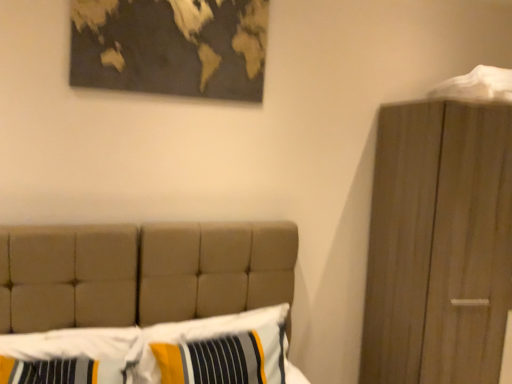
Question: Are striped fabric pillow at lower left, the second pillow viewed from the right, and white fabric at upper right far apart?

Choices:
 (A) yes
 (B) no

Answer: (A)

Question: From a real-world perspective, is striped fabric pillow at lower left, the second pillow viewed from the right, located beneath white fabric at upper right?

Choices:
 (A) yes
 (B) no

Answer: (A)

Question: Does striped fabric pillow at lower left, the second pillow viewed from the right, have a smaller size compared to white fabric at upper right?

Choices:
 (A) no
 (B) yes

Answer: (A)

Question: Is striped fabric pillow at lower left, the second pillow viewed from the right, positioned with its back to white fabric at upper right?

Choices:
 (A) no
 (B) yes

Answer: (A)

Question: Can you confirm if striped fabric pillow at lower left, which appears as the 1th pillow when viewed from the left, is positioned to the left of white fabric at upper right?

Choices:
 (A) no
 (B) yes

Answer: (B)

Question: From the image's perspective, is striped fabric pillow at lower left, which appears as the 1th pillow when viewed from the left, below white fabric at upper right?

Choices:
 (A) no
 (B) yes

Answer: (B)

Question: Does white fabric at upper right have a lesser height compared to striped fabric pillow at lower left, the second pillow viewed from the right?

Choices:
 (A) yes
 (B) no

Answer: (A)

Question: Is white fabric at upper right wider than striped fabric pillow at lower left, which appears as the 1th pillow when viewed from the left?

Choices:
 (A) no
 (B) yes

Answer: (B)

Question: Does white fabric at upper right appear on the right side of striped fabric pillow at lower left, the second pillow viewed from the right?

Choices:
 (A) no
 (B) yes

Answer: (B)

Question: From the image's perspective, is white fabric at upper right located beneath striped fabric pillow at lower left, the second pillow viewed from the right?

Choices:
 (A) no
 (B) yes

Answer: (A)

Question: Considering the relative sizes of white fabric at upper right and striped fabric pillow at lower left, which appears as the 1th pillow when viewed from the left, in the image provided, is white fabric at upper right thinner than striped fabric pillow at lower left, which appears as the 1th pillow when viewed from the left,?

Choices:
 (A) no
 (B) yes

Answer: (A)

Question: Is white fabric at upper right outside striped fabric pillow at lower left, the second pillow viewed from the right?

Choices:
 (A) no
 (B) yes

Answer: (B)

Question: Is the depth of striped fabric pillow at center, arranged as the second pillow when viewed from the left, greater than that of gold metallic map at upper center?

Choices:
 (A) no
 (B) yes

Answer: (A)